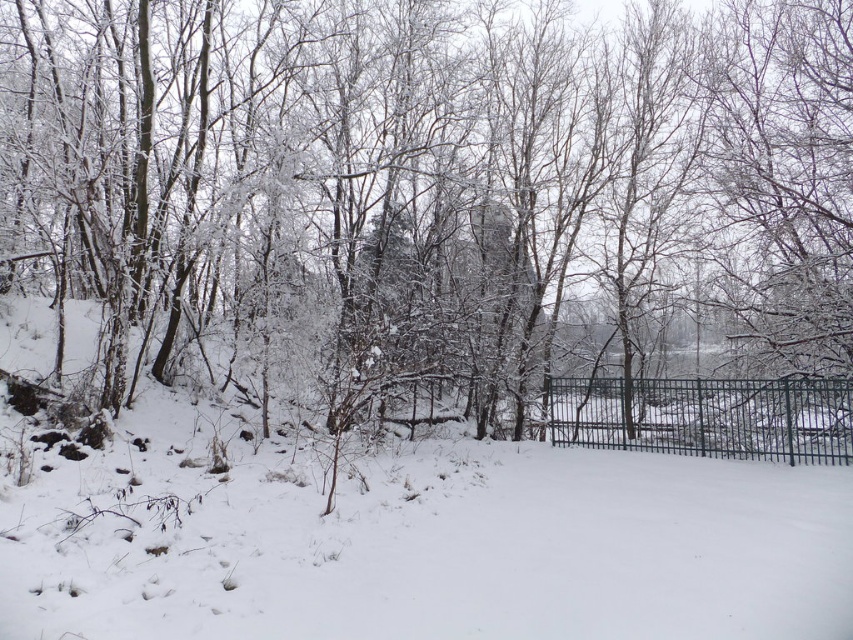
You are navigating through the snowy forest and see two points marked on your map. The first point is at coordinate point (381, 404) and the second is at point (785, 413). If you are facing north, which point is closer to you?

Point (381, 404) is behind point (785, 413), so if you are facing north, point (785, 413) is closer to you.

From the picture: You are standing in the winter forest scene and want to take a clear photo of the white fluffy snow at center. Since the trees block most of the light, where should you position your camera to ensure proper lighting?

You should position your camera at the point where the white fluffy snow at center is located, specifically at coordinates point (413, 540), to ensure proper lighting as it is the area with sufficient light for clear photography.